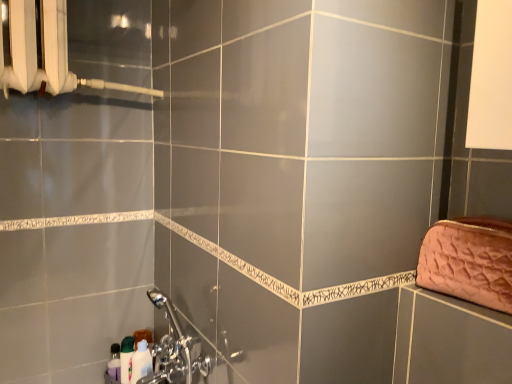
This screenshot has width=512, height=384. Describe the element at coordinates (469, 261) in the screenshot. I see `pink quilted fabric clutch at right` at that location.

What do you see at coordinates (45, 53) in the screenshot?
I see `white plastic radiator at upper left` at bounding box center [45, 53].

What do you see at coordinates (141, 362) in the screenshot?
I see `white glossy bottle at lower left, placed as the first toiletry when sorted from right to left` at bounding box center [141, 362].

What do you see at coordinates (126, 358) in the screenshot?
I see `green glossy bottle at lower left, acting as the second toiletry starting from the right` at bounding box center [126, 358].

The image size is (512, 384). What are the coordinates of `green glossy bottle at lower left, acting as the second toiletry starting from the right` in the screenshot? It's located at (126, 358).

Identify the location of pink quilted fabric clutch at right. (469, 261).

From a real-world perspective, is chrome metallic faucet at lower left above or below translucent plastic bottle at lower left, the third toiletry positioned from the right?

In terms of real-world spatial position, chrome metallic faucet at lower left is above translucent plastic bottle at lower left, the third toiletry positioned from the right.

Which point is more forward, [163,304] or [119,368]?

Point [163,304]

Does chrome metallic faucet at lower left lie in front of translucent plastic bottle at lower left, the 1th toiletry in the left-to-right sequence?

Yes.

From a real-world perspective, is green glossy bottle at lower left, acting as the second toiletry starting from the right, under white plastic radiator at upper left?

Indeed, from a real-world perspective, green glossy bottle at lower left, acting as the second toiletry starting from the right, is positioned beneath white plastic radiator at upper left.

Is green glossy bottle at lower left, acting as the second toiletry starting from the right, bigger or smaller than white plastic radiator at upper left?

Clearly, green glossy bottle at lower left, acting as the second toiletry starting from the right, is smaller in size than white plastic radiator at upper left.

Is green glossy bottle at lower left, acting as the second toiletry starting from the right, not close to white plastic radiator at upper left?

They are positioned close to each other.

Measure the distance from green glossy bottle at lower left, acting as the second toiletry starting from the right, to white plastic radiator at upper left.

green glossy bottle at lower left, acting as the second toiletry starting from the right, and white plastic radiator at upper left are 38.73 inches apart from each other.

Does chrome metallic faucet at lower left have a lesser width compared to green glossy bottle at lower left, acting as the second toiletry starting from the right?

In fact, chrome metallic faucet at lower left might be wider than green glossy bottle at lower left, acting as the second toiletry starting from the right.

Based on the photo, which of these two, chrome metallic faucet at lower left or green glossy bottle at lower left, the second toiletry in the left-to-right sequence, stands shorter?

With less height is green glossy bottle at lower left, the second toiletry in the left-to-right sequence.

Find the location of a particular element. This screenshot has height=384, width=512. plumbing fixture in front of the green glossy bottle at lower left, the second toiletry in the left-to-right sequence is located at coordinates (174, 350).

Is chrome metallic faucet at lower left inside or outside of green glossy bottle at lower left, the second toiletry in the left-to-right sequence?

chrome metallic faucet at lower left exists outside the volume of green glossy bottle at lower left, the second toiletry in the left-to-right sequence.

Does pink quilted fabric clutch at right touch translucent plastic bottle at lower left, the third toiletry positioned from the right?

pink quilted fabric clutch at right and translucent plastic bottle at lower left, the third toiletry positioned from the right, are clearly separated.

Is pink quilted fabric clutch at right inside or outside of translucent plastic bottle at lower left, the 1th toiletry in the left-to-right sequence?

pink quilted fabric clutch at right lies outside translucent plastic bottle at lower left, the 1th toiletry in the left-to-right sequence.

Considering the sizes of objects pink quilted fabric clutch at right and translucent plastic bottle at lower left, the 1th toiletry in the left-to-right sequence, in the image provided, who is thinner, pink quilted fabric clutch at right or translucent plastic bottle at lower left, the 1th toiletry in the left-to-right sequence,?

With smaller width is translucent plastic bottle at lower left, the 1th toiletry in the left-to-right sequence.

Does pink quilted fabric clutch at right have a greater height compared to green glossy bottle at lower left, acting as the second toiletry starting from the right?

No, pink quilted fabric clutch at right is not taller than green glossy bottle at lower left, acting as the second toiletry starting from the right.

From the image's perspective, is pink quilted fabric clutch at right above green glossy bottle at lower left, acting as the second toiletry starting from the right?

Yes, from the image's perspective, pink quilted fabric clutch at right is above green glossy bottle at lower left, acting as the second toiletry starting from the right.

Is pink quilted fabric clutch at right to the right of green glossy bottle at lower left, the second toiletry in the left-to-right sequence, from the viewer's perspective?

Yes.

Looking at their sizes, would you say pink quilted fabric clutch at right is wider or thinner than green glossy bottle at lower left, the second toiletry in the left-to-right sequence?

In the image, pink quilted fabric clutch at right appears to be wider than green glossy bottle at lower left, the second toiletry in the left-to-right sequence.

From the image's perspective, which is above, white plastic radiator at upper left or white glossy bottle at lower left, placed as the first toiletry when sorted from right to left?

From the image's view, white plastic radiator at upper left is above.

From the picture: Is white plastic radiator at upper left facing away from white glossy bottle at lower left, placed as the first toiletry when sorted from right to left?

No, white plastic radiator at upper left is not facing the opposite direction of white glossy bottle at lower left, placed as the first toiletry when sorted from right to left.

In terms of height, does white plastic radiator at upper left look taller or shorter compared to white glossy bottle at lower left, placed as the first toiletry when sorted from right to left?

white plastic radiator at upper left is taller than white glossy bottle at lower left, placed as the first toiletry when sorted from right to left.

Locate an element on the screen. toiletry that is the 1st object located behind the white plastic radiator at upper left is located at coordinates (141, 362).

Is green glossy bottle at lower left, the second toiletry in the left-to-right sequence, not close to chrome metallic faucet at lower left?

green glossy bottle at lower left, the second toiletry in the left-to-right sequence, is actually quite close to chrome metallic faucet at lower left.

Can you confirm if green glossy bottle at lower left, the second toiletry in the left-to-right sequence, is positioned to the left of chrome metallic faucet at lower left?

Indeed, green glossy bottle at lower left, the second toiletry in the left-to-right sequence, is positioned on the left side of chrome metallic faucet at lower left.

Is green glossy bottle at lower left, the second toiletry in the left-to-right sequence, oriented away from chrome metallic faucet at lower left?

No.

In the scene shown: From a real-world perspective, which is physically above, green glossy bottle at lower left, the second toiletry in the left-to-right sequence, or chrome metallic faucet at lower left?

From a 3D spatial view, chrome metallic faucet at lower left is above.

The height and width of the screenshot is (384, 512). I want to click on plumbing fixture above the translucent plastic bottle at lower left, the 1th toiletry in the left-to-right sequence (from a real-world perspective), so click(x=174, y=350).

In order to click on toiletry that is the 2nd object directly below the white plastic radiator at upper left (from a real-world perspective) in this screenshot , I will do `click(126, 358)`.

From the image, which object appears to be farther from pink quilted fabric clutch at right, translucent plastic bottle at lower left, the third toiletry positioned from the right, or green glossy bottle at lower left, acting as the second toiletry starting from the right?

Based on the image, translucent plastic bottle at lower left, the third toiletry positioned from the right, appears to be further to pink quilted fabric clutch at right.

Based on their spatial positions, is chrome metallic faucet at lower left or translucent plastic bottle at lower left, the 1th toiletry in the left-to-right sequence, closer to green glossy bottle at lower left, the second toiletry in the left-to-right sequence?

Among the two, translucent plastic bottle at lower left, the 1th toiletry in the left-to-right sequence, is located nearer to green glossy bottle at lower left, the second toiletry in the left-to-right sequence.

Considering their positions, is green glossy bottle at lower left, the second toiletry in the left-to-right sequence, positioned closer to translucent plastic bottle at lower left, the 1th toiletry in the left-to-right sequence, than chrome metallic faucet at lower left?

green glossy bottle at lower left, the second toiletry in the left-to-right sequence, is positioned closer to the anchor translucent plastic bottle at lower left, the 1th toiletry in the left-to-right sequence.

Estimate the real-world distances between objects in this image. Which object is closer to green glossy bottle at lower left, the second toiletry in the left-to-right sequence, pink quilted fabric clutch at right or white plastic radiator at upper left?

The object closer to green glossy bottle at lower left, the second toiletry in the left-to-right sequence, is white plastic radiator at upper left.

Looking at the image, which one is located closer to chrome metallic faucet at lower left, white glossy bottle at lower left, the third toiletry viewed from the left, or green glossy bottle at lower left, acting as the second toiletry starting from the right?

white glossy bottle at lower left, the third toiletry viewed from the left, lies closer to chrome metallic faucet at lower left than the other object.

In the scene shown: Estimate the real-world distances between objects in this image. Which object is further from translucent plastic bottle at lower left, the 1th toiletry in the left-to-right sequence, pink quilted fabric clutch at right or white plastic radiator at upper left?

pink quilted fabric clutch at right is positioned further to the anchor translucent plastic bottle at lower left, the 1th toiletry in the left-to-right sequence.

When comparing their distances from white glossy bottle at lower left, the third toiletry viewed from the left, does chrome metallic faucet at lower left or green glossy bottle at lower left, the second toiletry in the left-to-right sequence, seem further?

Among the two, chrome metallic faucet at lower left is located further to white glossy bottle at lower left, the third toiletry viewed from the left.

When comparing their distances from pink quilted fabric clutch at right, does translucent plastic bottle at lower left, the 1th toiletry in the left-to-right sequence, or white glossy bottle at lower left, placed as the first toiletry when sorted from right to left, seem further?

The object further to pink quilted fabric clutch at right is translucent plastic bottle at lower left, the 1th toiletry in the left-to-right sequence.

Where is `plumbing fixture situated between green glossy bottle at lower left, acting as the second toiletry starting from the right, and pink quilted fabric clutch at right from left to right`? This screenshot has height=384, width=512. plumbing fixture situated between green glossy bottle at lower left, acting as the second toiletry starting from the right, and pink quilted fabric clutch at right from left to right is located at coordinates (174, 350).

Image resolution: width=512 pixels, height=384 pixels. I want to click on toiletry between green glossy bottle at lower left, the second toiletry in the left-to-right sequence, and pink quilted fabric clutch at right, so click(x=141, y=362).

Locate an element on the screen. plumbing fixture between white plastic radiator at upper left and green glossy bottle at lower left, acting as the second toiletry starting from the right, from top to bottom is located at coordinates (174, 350).

The height and width of the screenshot is (384, 512). I want to click on toiletry between white plastic radiator at upper left and green glossy bottle at lower left, acting as the second toiletry starting from the right, vertically, so click(141, 362).